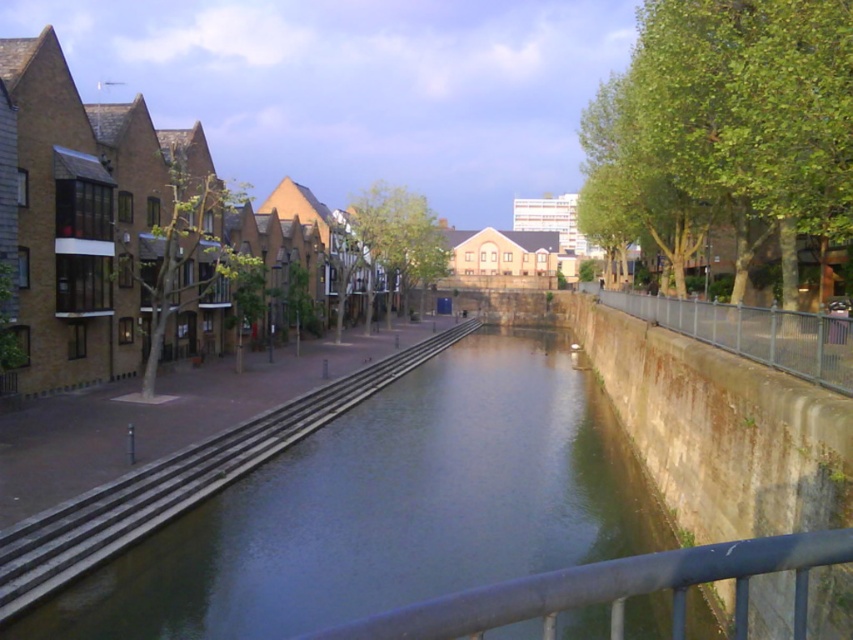
Is point (374, 388) positioned in front of point (560, 596)?

No.

Can you confirm if smooth concrete steps at center is positioned to the right of smooth metal railing at center?

Incorrect, smooth concrete steps at center is not on the right side of smooth metal railing at center.

Does point (230, 461) come farther from viewer compared to point (796, 593)?

Yes, it is.

Locate an element on the screen. This screenshot has width=853, height=640. smooth concrete steps at center is located at coordinates (178, 483).

Is smooth concrete steps at center below rusty metal fence at right?

Yes.

Is smooth concrete steps at center to the left of rusty metal fence at right from the viewer's perspective?

Correct, you'll find smooth concrete steps at center to the left of rusty metal fence at right.

Which is behind, point (253, 429) or point (844, 387)?

The point (253, 429) is more distant.

I want to click on smooth concrete steps at center, so click(178, 483).

In the scene shown: Is smooth metal railing at center to the right of rusty metal fence at right from the viewer's perspective?

No, smooth metal railing at center is not to the right of rusty metal fence at right.

Consider the image. Is smooth metal railing at center closer to the viewer compared to rusty metal fence at right?

Yes, smooth metal railing at center is closer to the viewer.

Measure the distance between point (x=541, y=602) and camera.

1.67 meters

This screenshot has width=853, height=640. I want to click on smooth metal railing at center, so click(614, 589).